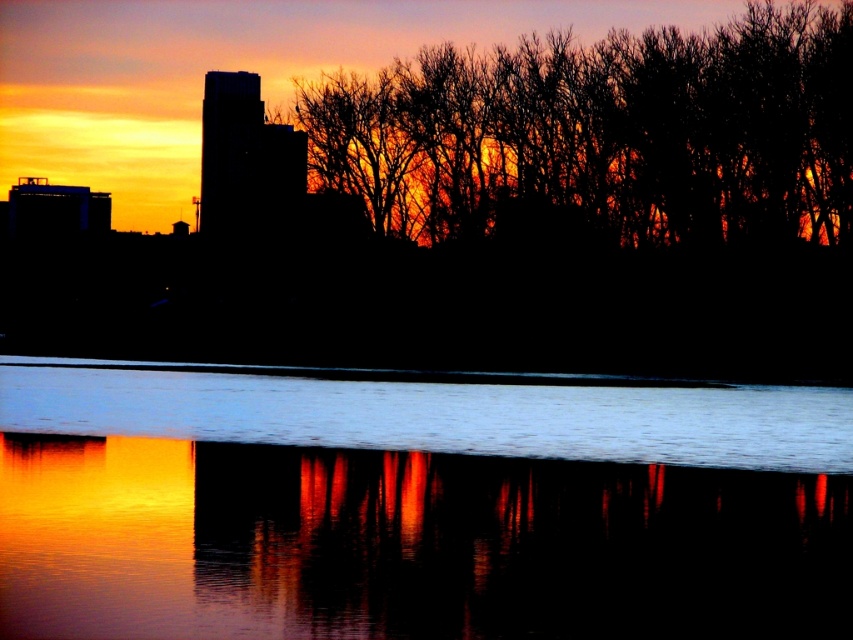
Question: Can you confirm if smooth glass water at center is positioned below silhouette bare trees at upper center?

Choices:
 (A) no
 (B) yes

Answer: (B)

Question: Is the position of smooth glass water at center less distant than that of silhouette bare trees at upper center?

Choices:
 (A) no
 (B) yes

Answer: (B)

Question: Is smooth glass water at center wider than silhouette bare trees at upper center?

Choices:
 (A) yes
 (B) no

Answer: (A)

Question: Which of the following is the farthest from the observer?

Choices:
 (A) (505, 611)
 (B) (457, 109)

Answer: (B)